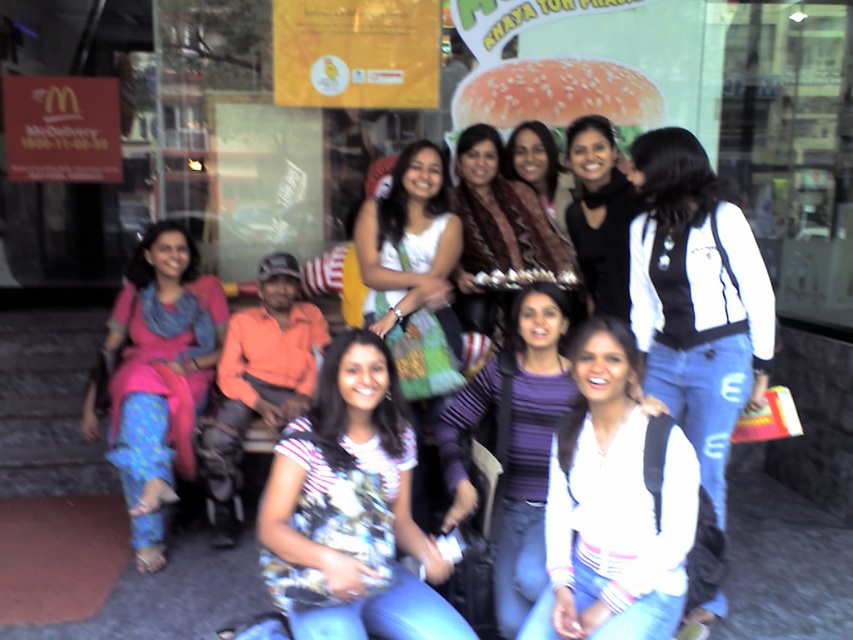
You are standing in front of the McDonalds entrance and see the white matte jacket at center. If you were to walk directly towards the jacket, which direction would you head?

Since the white matte jacket at center is located at point 0.467 on the x and 0.817 on the y axis, you would walk towards the lower center direction to reach it.

Looking at this image, you are a photographer trying to compose a shot of the striped cotton shirt at center and the white matte jacket at center. Which clothing item should you focus on first if you want to highlight the taller one?

The white matte jacket at center is taller than the striped cotton shirt at center, so you should focus on the white matte jacket at center first to highlight its height.

You are a photographer trying to capture a group photo at McDonalds. You notice the black matte jacket at upper center and the striped shirt at center. Which clothing item is positioned higher in the frame?

The black matte jacket at upper center is taller than the striped shirt at center, so it is positioned higher in the frame.